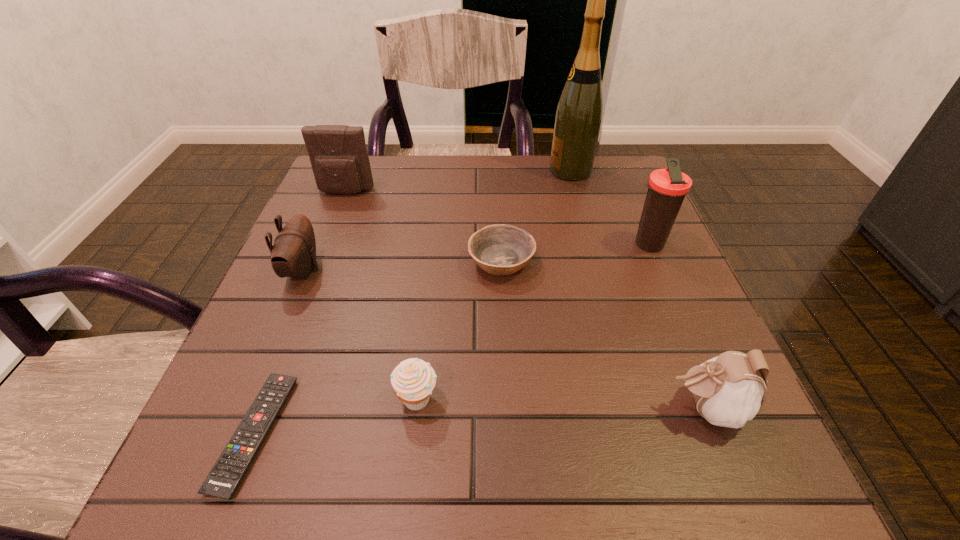
Locate an element on the screen. thermos bottle at the right edge is located at coordinates (667, 188).

You are a GUI agent. You are given a task and a screenshot of the screen. Output one action in this format:
    pyautogui.click(x=<x>, y=<y>)
    Task: Click on the pouch that is at the right edge
    The image size is (960, 540).
    Given the screenshot: What is the action you would take?
    [x=729, y=389]

Where is `object situated at the far left corner`? The height and width of the screenshot is (540, 960). object situated at the far left corner is located at coordinates (338, 155).

Locate an element on the screen. This screenshot has width=960, height=540. object that is at the near left corner is located at coordinates (229, 470).

The image size is (960, 540). I want to click on object located in the far right corner section of the desktop, so click(579, 113).

Locate an element on the screen. The height and width of the screenshot is (540, 960). object at the near right corner is located at coordinates (729, 389).

Find the location of a particular element. This screenshot has height=540, width=960. free point at the far edge is located at coordinates (395, 190).

Find the location of a particular element. vacant space at the near edge is located at coordinates (314, 497).

This screenshot has width=960, height=540. In order to click on free region at the right edge of the desktop in this screenshot , I will do `click(672, 413)`.

This screenshot has height=540, width=960. In the image, there is a desktop. What are the coordinates of `free region at the far right corner` in the screenshot? It's located at (597, 179).